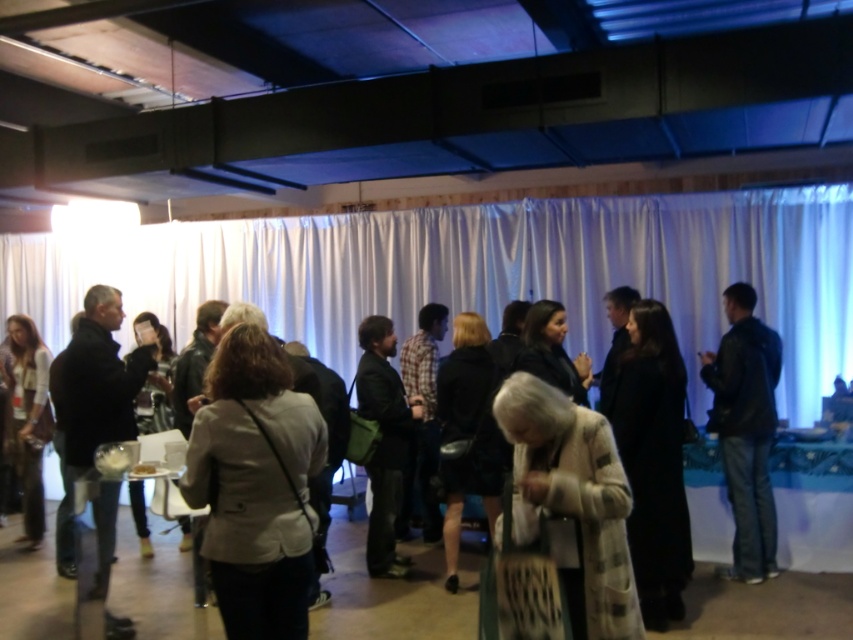
Question: Which object is the closest to the black leather jacket at right?

Choices:
 (A) black wool coat at center
 (B) dark brown leather jacket at center

Answer: (A)

Question: Which point appears closest to the camera in this image?

Choices:
 (A) (358, 340)
 (B) (28, 371)
 (C) (743, 316)
 (D) (229, 432)

Answer: (D)

Question: Considering the relative positions of light beige jacket at center and matte white shirt at left in the image provided, where is light beige jacket at center located with respect to matte white shirt at left?

Choices:
 (A) left
 (B) right

Answer: (B)

Question: Estimate the real-world distances between objects in this image. Which object is closer to the dark brown leather jacket at center?

Choices:
 (A) black leather jacket at left
 (B) white textured coat at center
 (C) black wool coat at center
 (D) black leather jacket at right

Answer: (A)

Question: Where is black wool coat at center located in relation to black leather jacket at right in the image?

Choices:
 (A) above
 (B) below

Answer: (B)

Question: Can you confirm if light beige jacket at center is bigger than dark brown leather jacket at center?

Choices:
 (A) yes
 (B) no

Answer: (B)